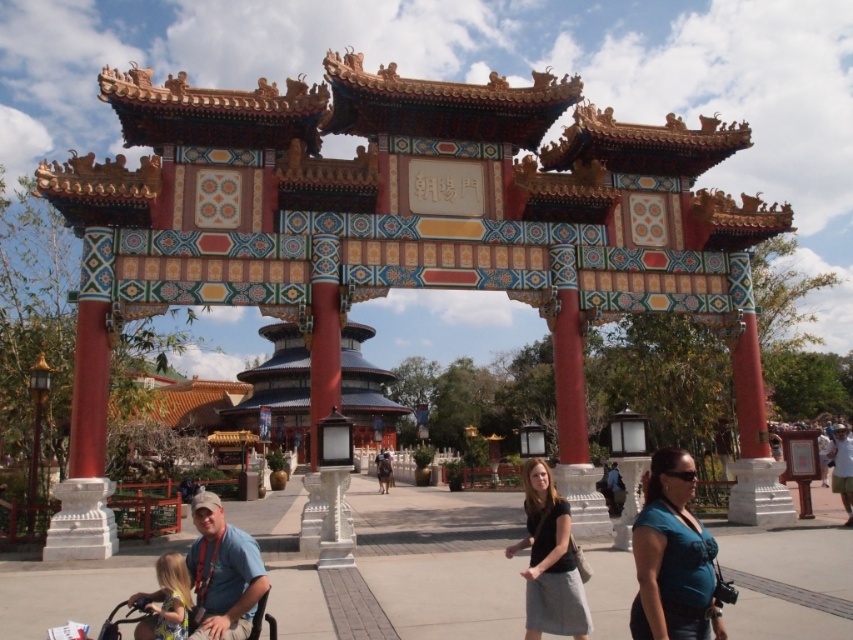
You are standing in front of the traditional Chinese gate and notice an object in the scene. Where is the matte blue shirt at lower left located in the image?

The matte blue shirt at lower left is located at point (222,572) in the image.

You are a photographer planning to capture a photo of the traditional Chinese gate. You have two shirts to choose from for your outfit, the matte blue shirt at lower left and the dark blue shirt at center. If you want to wear the shirt that is wider, which one should you choose?

The matte blue shirt at lower left might be wider than dark blue shirt at center, so you should choose the matte blue shirt at lower left.

You are a tailor observing the black cotton shirt at center and the light brown leather jacket at lower right. Which garment has a smaller width when laid flat?

The black cotton shirt at center is thinner than the light brown leather jacket at lower right, so the black cotton shirt at center has a smaller width when laid flat.